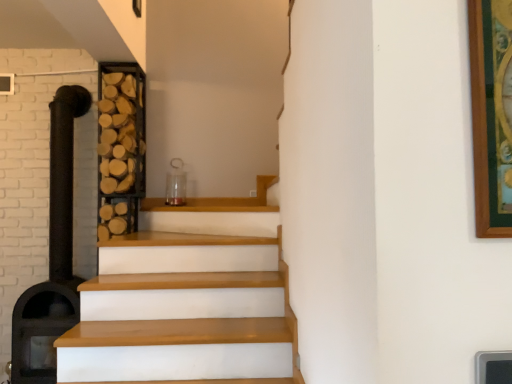
You are a GUI agent. You are given a task and a screenshot of the screen. Output one action in this format:
    pyautogui.click(x=<x>, y=<y>)
    Task: Click on the wooden at left
    Image resolution: width=512 pixels, height=384 pixels.
    Given the screenshot: What is the action you would take?
    pyautogui.click(x=120, y=147)

Measure the distance between wooden at left and camera.

wooden at left and camera are 9.69 feet apart from each other.

What do you see at coordinates (120, 147) in the screenshot? I see `wooden at left` at bounding box center [120, 147].

In order to face black matte fireplace at left, should I rotate leftwards or rightwards?

To face it directly, rotate left by 24.310 degrees.

Locate an element on the screen. The height and width of the screenshot is (384, 512). black matte fireplace at left is located at coordinates (52, 256).

Describe the element at coordinates (52, 256) in the screenshot. I see `black matte fireplace at left` at that location.

The width and height of the screenshot is (512, 384). In order to click on wooden at left in this screenshot , I will do `click(120, 147)`.

Which object is positioned more to the right, black matte fireplace at left or wooden at left?

wooden at left.

Between black matte fireplace at left and wooden at left, which one is positioned behind?

Answer: wooden at left is further away from the camera.

Which is in front, point (52, 194) or point (141, 168)?

The point (52, 194) is closer.

From the image's perspective, would you say black matte fireplace at left is shown under wooden at left?

Yes.

From a real-world perspective, is black matte fireplace at left physically located above or below wooden at left?

Clearly, from a real-world perspective, black matte fireplace at left is below wooden at left.

Considering the sizes of objects black matte fireplace at left and wooden at left in the image provided, who is thinner, black matte fireplace at left or wooden at left?

With smaller width is wooden at left.

Can you confirm if black matte fireplace at left is shorter than wooden at left?

Incorrect, the height of black matte fireplace at left does not fall short of that of wooden at left.

Consider the image. Does black matte fireplace at left have a larger size compared to wooden at left?

Yes, black matte fireplace at left is bigger than wooden at left.

Is black matte fireplace at left not inside wooden at left?

Absolutely, black matte fireplace at left is external to wooden at left.

Is black matte fireplace at left in contact with wooden at left?

black matte fireplace at left and wooden at left are clearly separated.

Is black matte fireplace at left aimed at wooden at left?

No, black matte fireplace at left is not turned towards wooden at left.

What are the coordinates of `shelf above the black matte fireplace at left (from the image's perspective)` in the screenshot? It's located at (120, 147).

In the scene shown: Considering the relative positions of wooden at left and black matte fireplace at left in the image provided, is wooden at left to the left or to the right of black matte fireplace at left?

wooden at left is to the right of black matte fireplace at left.

Is wooden at left further to the viewer compared to black matte fireplace at left?

Yes, wooden at left is further from the viewer.

Considering the points (142, 100) and (30, 338), which point is behind, point (142, 100) or point (30, 338)?

The point (142, 100) is farther.

From the image's perspective, is wooden at left located above or below black matte fireplace at left?

Clearly, from the image's perspective, wooden at left is above black matte fireplace at left.

From a real-world perspective, does wooden at left sit lower than black matte fireplace at left?

Actually, wooden at left is physically above black matte fireplace at left in the real world.

Does wooden at left have a lesser width compared to black matte fireplace at left?

Yes, wooden at left is thinner than black matte fireplace at left.

Considering the sizes of objects wooden at left and black matte fireplace at left in the image provided, who is shorter, wooden at left or black matte fireplace at left?

wooden at left is shorter.

Can you confirm if wooden at left is bigger than black matte fireplace at left?

No, wooden at left is not bigger than black matte fireplace at left.

Is black matte fireplace at left completely or partially inside wooden at left?

Definitely not — black matte fireplace at left is not inside wooden at left.

Are wooden at left and black matte fireplace at left far apart?

No, wooden at left is not far from black matte fireplace at left.

Is black matte fireplace at left at the back of wooden at left?

wooden at left does not have its back to black matte fireplace at left.

Identify the location of fireplace lying in front of the wooden at left. (52, 256).

This screenshot has width=512, height=384. I want to click on fireplace lying below the wooden at left (from the image's perspective), so click(52, 256).

Locate an element on the screen. fireplace below the wooden at left (from a real-world perspective) is located at coordinates (52, 256).